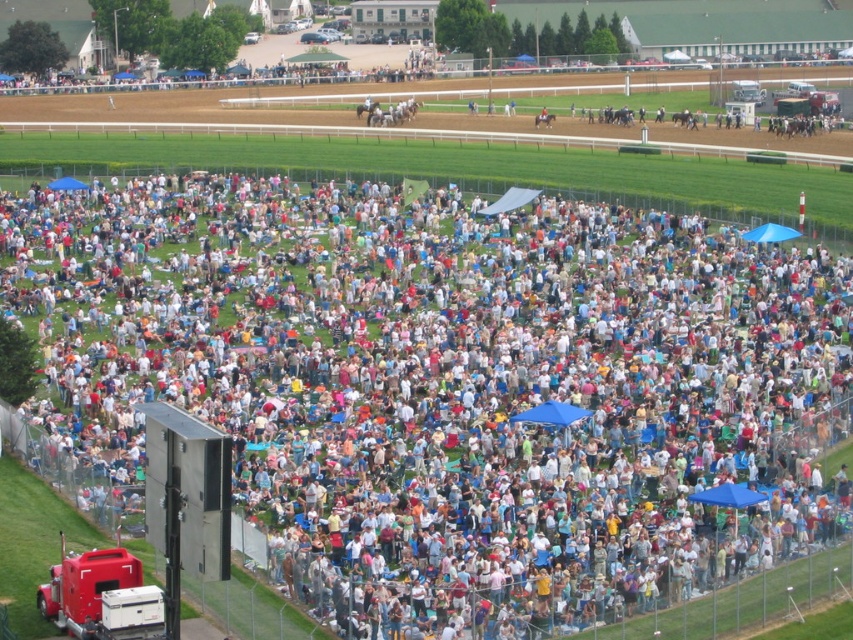
Image resolution: width=853 pixels, height=640 pixels. What do you see at coordinates (447, 388) in the screenshot?
I see `white casual clothing at center` at bounding box center [447, 388].

Between white casual clothing at center and brown glossy horse at center, which one has more height?

With more height is white casual clothing at center.

Between point (120, 228) and point (544, 122), which one is positioned behind?

Positioned behind is point (544, 122).

You are a GUI agent. You are given a task and a screenshot of the screen. Output one action in this format:
    pyautogui.click(x=<x>, y=<y>)
    Task: Click on the white casual clothing at center
    
    Given the screenshot: What is the action you would take?
    pyautogui.click(x=447, y=388)

Between red matte trailer truck at lower left and brown glossy horse at center, which one appears on the right side from the viewer's perspective?

brown glossy horse at center is more to the right.

Is red matte trailer truck at lower left shorter than brown glossy horse at center?

In fact, red matte trailer truck at lower left may be taller than brown glossy horse at center.

Looking at this image, who is more distant from viewer, (57, 588) or (537, 120)?

Point (537, 120)

At what (x,y) coordinates should I click in order to perform the action: click on red matte trailer truck at lower left. Please return your answer as a coordinate pair (x, y). The image size is (853, 640). Looking at the image, I should click on (97, 595).

Who is positioned more to the left, white casual clothing at center or red matte trailer truck at lower left?

red matte trailer truck at lower left

Is point (386, 308) less distant than point (41, 616)?

That is False.

This screenshot has width=853, height=640. What do you see at coordinates (447, 388) in the screenshot? I see `white casual clothing at center` at bounding box center [447, 388].

Locate an element on the screen. Image resolution: width=853 pixels, height=640 pixels. white casual clothing at center is located at coordinates (447, 388).